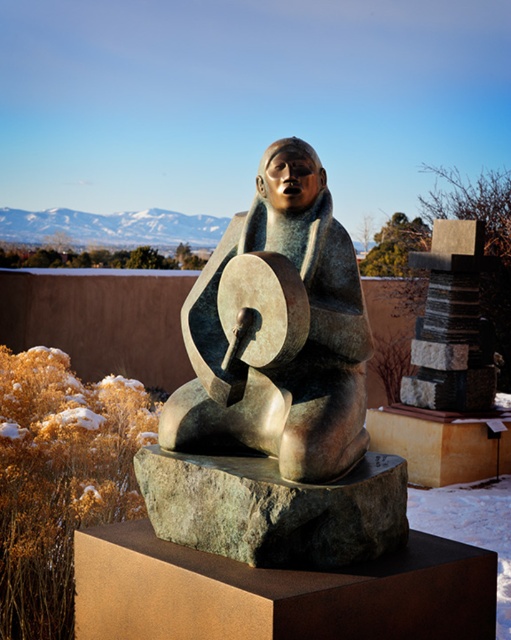
Can you confirm if bronze statue at center is shorter than green rough stone at center?

Incorrect, bronze statue at center's height does not fall short of green rough stone at center's.

Is bronze statue at center taller than green rough stone at center?

Correct, bronze statue at center is much taller as green rough stone at center.

This screenshot has height=640, width=511. Find the location of `bronze statue at center`. bronze statue at center is located at coordinates (276, 392).